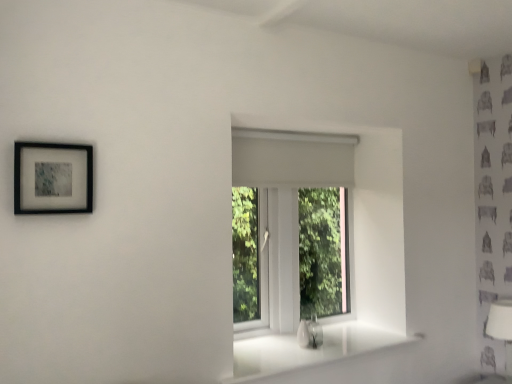
Locate an element on the screen. The width and height of the screenshot is (512, 384). free region on the left part of white glossy sink at lower center is located at coordinates (279, 347).